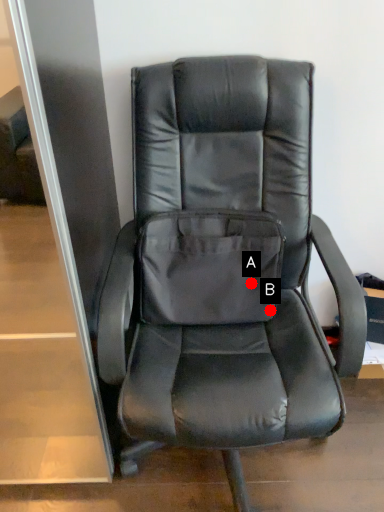
Question: Two points are circled on the image, labeled by A and B beside each circle. Which point is closer to the camera?

Choices:
 (A) A is closer
 (B) B is closer

Answer: (A)